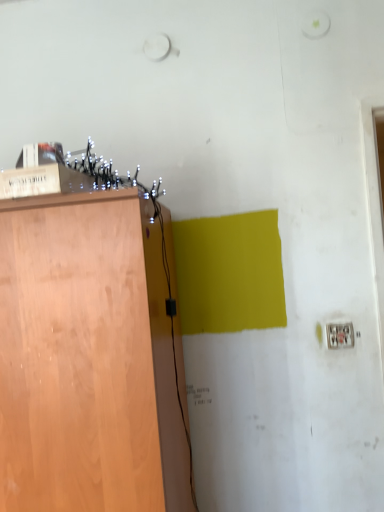
The width and height of the screenshot is (384, 512). Find the location of `wooden cabinet at left`. wooden cabinet at left is located at coordinates (87, 358).

Describe the element at coordinates (87, 358) in the screenshot. I see `wooden cabinet at left` at that location.

Where is `wooden cabinet at left`? wooden cabinet at left is located at coordinates (87, 358).